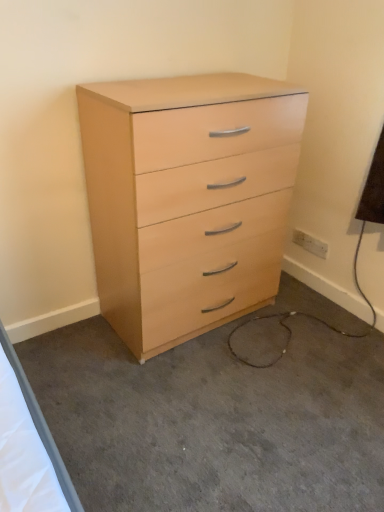
Question: Can you confirm if light wood dresser at center is bigger than white plastic electric outlet at lower right?

Choices:
 (A) yes
 (B) no

Answer: (A)

Question: From the image's perspective, is light wood dresser at center on top of white plastic electric outlet at lower right?

Choices:
 (A) no
 (B) yes

Answer: (A)

Question: Is white plastic electric outlet at lower right a part of light wood dresser at center?

Choices:
 (A) no
 (B) yes

Answer: (A)

Question: Is light wood dresser at center far from white plastic electric outlet at lower right?

Choices:
 (A) yes
 (B) no

Answer: (A)

Question: Is light wood dresser at center facing away from white plastic electric outlet at lower right?

Choices:
 (A) no
 (B) yes

Answer: (A)

Question: Does point (180, 214) appear closer or farther from the camera than point (304, 236)?

Choices:
 (A) closer
 (B) farther

Answer: (A)

Question: From the image's perspective, relative to white plastic electric outlet at lower right, is light wood/finish chest of drawers at center above or below?

Choices:
 (A) above
 (B) below

Answer: (A)

Question: Do you think light wood/finish chest of drawers at center is within white plastic electric outlet at lower right, or outside of it?

Choices:
 (A) outside
 (B) inside

Answer: (A)

Question: Is light wood/finish chest of drawers at center to the left or to the right of white plastic electric outlet at lower right in the image?

Choices:
 (A) right
 (B) left

Answer: (B)

Question: In the image, is light wood dresser at center on the left side or the right side of light wood/finish chest of drawers at center?

Choices:
 (A) right
 (B) left

Answer: (A)

Question: From a real-world perspective, relative to light wood/finish chest of drawers at center, is light wood dresser at center vertically above or below?

Choices:
 (A) above
 (B) below

Answer: (B)

Question: From the image's perspective, is light wood dresser at center positioned above or below light wood/finish chest of drawers at center?

Choices:
 (A) above
 (B) below

Answer: (B)

Question: Relative to light wood/finish chest of drawers at center, is light wood dresser at center in front or behind?

Choices:
 (A) behind
 (B) front

Answer: (B)

Question: Based on their positions, is light wood dresser at center located to the left or right of white plastic electric outlet at lower right?

Choices:
 (A) right
 (B) left

Answer: (B)

Question: Considering the positions of light wood dresser at center and white plastic electric outlet at lower right in the image, is light wood dresser at center taller or shorter than white plastic electric outlet at lower right?

Choices:
 (A) tall
 (B) short

Answer: (B)